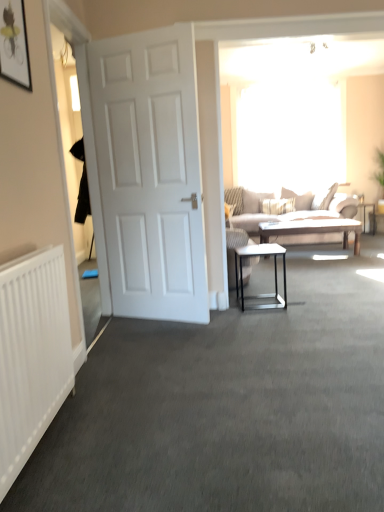
In order to face white matte door at left, should I rotate leftwards or rightwards?

Rotate left and turn 5.437 degrees.

You are a GUI agent. You are given a task and a screenshot of the screen. Output one action in this format:
    pyautogui.click(x=<x>, y=<y>)
    Task: Click on the white textured radiator at left
    Image resolution: width=384 pixels, height=512 pixels.
    Given the screenshot: What is the action you would take?
    pyautogui.click(x=32, y=354)

Describe the element at coordinates (290, 212) in the screenshot. I see `beige fabric couch at center` at that location.

What do you see at coordinates (364, 214) in the screenshot?
I see `metallic silver side table at right` at bounding box center [364, 214].

Identify the location of wooden polished coffee table at center. (313, 229).

Could metallic silver side table at right be considered to be inside white textured radiator at left?

Definitely not — metallic silver side table at right is not inside white textured radiator at left.

This screenshot has width=384, height=512. Find the location of `side table located on the right of white textured radiator at left`. side table located on the right of white textured radiator at left is located at coordinates (364, 214).

Considering the relative sizes of white textured radiator at left and metallic silver side table at right in the image provided, is white textured radiator at left wider than metallic silver side table at right?

No, white textured radiator at left is not wider than metallic silver side table at right.

Which object is closer to the camera taking this photo, white textured radiator at left or metallic silver side table at right?

Positioned in front is white textured radiator at left.

Who is shorter, beige fabric couch at center or matte black picture frame at upper left?

With less height is matte black picture frame at upper left.

Considering the relative sizes of beige fabric couch at center and matte black picture frame at upper left in the image provided, is beige fabric couch at center smaller than matte black picture frame at upper left?

No.

Between beige fabric couch at center and matte black picture frame at upper left, which one is positioned behind?

Positioned behind is beige fabric couch at center.

Between point (106, 54) and point (1, 8), which one is positioned in front?

Positioned in front is point (1, 8).

How much distance is there between white matte door at left and matte black picture frame at upper left?

white matte door at left and matte black picture frame at upper left are 4.20 feet apart.

Can you confirm if white matte door at left is positioned to the left of matte black picture frame at upper left?

No.

Which object is positioned more to the right, white glossy side table at center or matte black picture frame at upper left?

Positioned to the right is white glossy side table at center.

Between white glossy side table at center and matte black picture frame at upper left, which one has less height?

matte black picture frame at upper left.

Is matte black picture frame at upper left completely or partially inside white glossy side table at center?

No, white glossy side table at center does not contain matte black picture frame at upper left.

Is white glossy side table at center turned away from matte black picture frame at upper left?

No, matte black picture frame at upper left is not at the back of white glossy side table at center.

Is white glossy side table at center spatially inside beige fabric couch at center, or outside of it?

white glossy side table at center is not enclosed by beige fabric couch at center.

Can you confirm if white glossy side table at center is shorter than beige fabric couch at center?

Correct, white glossy side table at center is not as tall as beige fabric couch at center.

Visually, is white glossy side table at center positioned to the left or to the right of beige fabric couch at center?

From the image, it's evident that white glossy side table at center is to the left of beige fabric couch at center.

In the scene shown: Is white glossy side table at center positioned far away from beige fabric couch at center?

Absolutely, white glossy side table at center is distant from beige fabric couch at center.

Is matte black picture frame at upper left further to the viewer compared to white glossy side table at center?

No, the depth of matte black picture frame at upper left is less than that of white glossy side table at center.

From a real-world perspective, is matte black picture frame at upper left on top of white glossy side table at center?

Yes.

Could you tell me if matte black picture frame at upper left is facing white glossy side table at center?

No, matte black picture frame at upper left is not turned towards white glossy side table at center.

Does matte black picture frame at upper left have a greater height compared to white glossy side table at center?

No, matte black picture frame at upper left is not taller than white glossy side table at center.

Between transparent glass window at upper center and white textured radiator at left, which one has larger size?

Bigger between the two is transparent glass window at upper center.

Are transparent glass window at upper center and white textured radiator at left located far from each other?

transparent glass window at upper center is far away from white textured radiator at left.

From a real-world perspective, which object stands above the other?

In real-world perspective, transparent glass window at upper center is above.

How distant is transparent glass window at upper center from white textured radiator at left?

transparent glass window at upper center is 4.86 meters from white textured radiator at left.

The height and width of the screenshot is (512, 384). What are the coordinates of `radiator that appears on the left of metallic silver side table at right` in the screenshot? It's located at (32, 354).

Image resolution: width=384 pixels, height=512 pixels. What are the coordinates of `studio couch that appears below the matte black picture frame at upper left (from the image's perspective)` in the screenshot? It's located at (290, 212).

Based on their spatial positions, is white matte door at left or wooden polished coffee table at center closer to metallic silver side table at right?

wooden polished coffee table at center.

Looking at the image, which one is located further to white textured radiator at left, white matte door at left or transparent glass window at upper center?

transparent glass window at upper center is further to white textured radiator at left.

Which object lies further to the anchor point white matte door at left, metallic silver side table at right or matte black picture frame at upper left?

metallic silver side table at right.

From the image, which object appears to be nearer to white matte door at left, matte black picture frame at upper left or beige fabric couch at center?

matte black picture frame at upper left lies closer to white matte door at left than the other object.

Looking at the image, which one is located further to white matte door at left, white textured radiator at left or matte black picture frame at upper left?

Among the two, white textured radiator at left is located further to white matte door at left.

Based on their spatial positions, is beige fabric couch at center or metallic silver side table at right closer to transparent glass window at upper center?

beige fabric couch at center.

Looking at the image, which one is located closer to transparent glass window at upper center, wooden polished coffee table at center or matte black picture frame at upper left?

Among the two, wooden polished coffee table at center is located nearer to transparent glass window at upper center.

Estimate the real-world distances between objects in this image. Which object is further from metallic silver side table at right, wooden polished coffee table at center or transparent glass window at upper center?

Based on the image, transparent glass window at upper center appears to be further to metallic silver side table at right.

Locate an element on the screen. door positioned between white textured radiator at left and white glossy side table at center from near to far is located at coordinates (147, 172).

The height and width of the screenshot is (512, 384). What are the coordinates of `table between white textured radiator at left and beige fabric couch at center along the z-axis` in the screenshot? It's located at (274, 272).

This screenshot has width=384, height=512. I want to click on side table between white textured radiator at left and transparent glass window at upper center along the z-axis, so click(x=364, y=214).

Where is `table between matte black picture frame at upper left and wooden polished coffee table at center along the z-axis`? table between matte black picture frame at upper left and wooden polished coffee table at center along the z-axis is located at coordinates (274, 272).